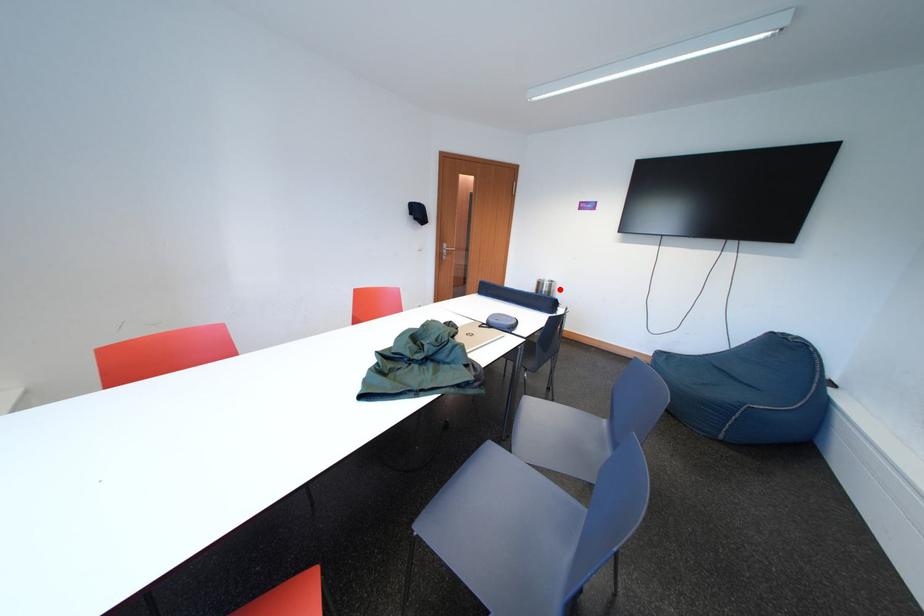
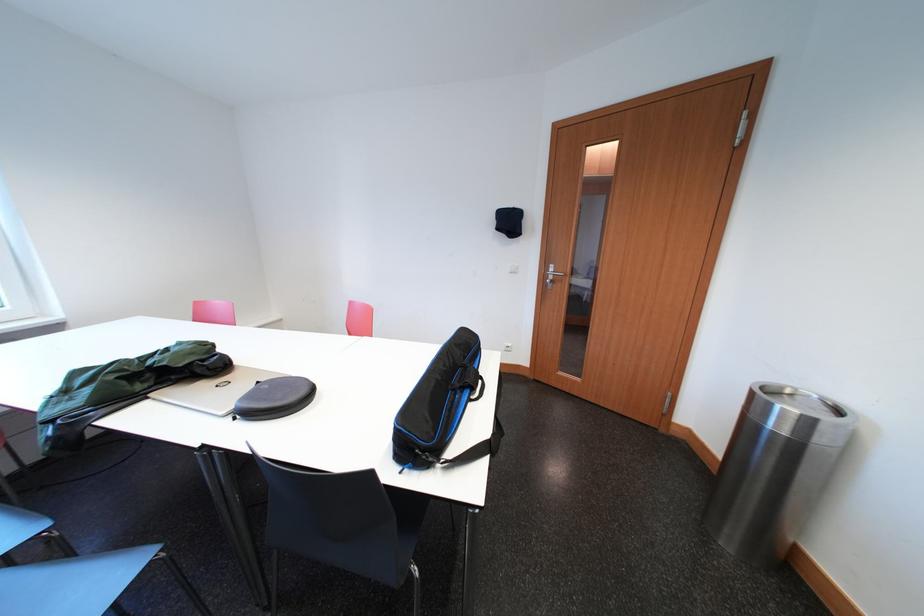
Where in the second image is the point corresponding to the highlighted location from the first image?

(819, 426)